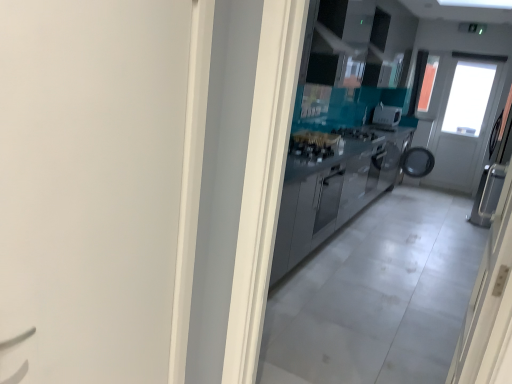
Question: Does satin silver toaster at center have a lesser width compared to satin silver cabinetry at center?

Choices:
 (A) no
 (B) yes

Answer: (B)

Question: Is satin silver toaster at center surrounding satin silver cabinetry at center?

Choices:
 (A) no
 (B) yes

Answer: (A)

Question: From a real-world perspective, does satin silver toaster at center sit lower than satin silver cabinetry at center?

Choices:
 (A) yes
 (B) no

Answer: (B)

Question: Is satin silver toaster at center turned away from satin silver cabinetry at center?

Choices:
 (A) no
 (B) yes

Answer: (A)

Question: Can you confirm if satin silver toaster at center is smaller than satin silver cabinetry at center?

Choices:
 (A) yes
 (B) no

Answer: (A)

Question: From the image's perspective, is satin silver toaster at center located beneath satin silver cabinetry at center?

Choices:
 (A) no
 (B) yes

Answer: (A)

Question: From the image's perspective, is satin silver cabinetry at center located beneath satin silver door at right, acting as the second door starting from the left?

Choices:
 (A) no
 (B) yes

Answer: (A)

Question: From a real-world perspective, does satin silver cabinetry at center stand above satin silver door at right, acting as the second door starting from the left?

Choices:
 (A) no
 (B) yes

Answer: (A)

Question: Does satin silver cabinetry at center have a smaller size compared to satin silver door at right, acting as the first door starting from the right?

Choices:
 (A) yes
 (B) no

Answer: (B)

Question: Can you confirm if satin silver cabinetry at center is taller than satin silver door at right, acting as the first door starting from the right?

Choices:
 (A) no
 (B) yes

Answer: (A)

Question: Is satin silver cabinetry at center to the right of satin silver door at right, acting as the first door starting from the right, from the viewer's perspective?

Choices:
 (A) yes
 (B) no

Answer: (A)

Question: Considering the relative sizes of satin silver cabinetry at center and satin silver door at right, acting as the second door starting from the left, in the image provided, is satin silver cabinetry at center thinner than satin silver door at right, acting as the second door starting from the left,?

Choices:
 (A) no
 (B) yes

Answer: (A)

Question: From a real-world perspective, is satin silver door at right, acting as the first door starting from the right, below satin silver cabinetry at center?

Choices:
 (A) no
 (B) yes

Answer: (A)